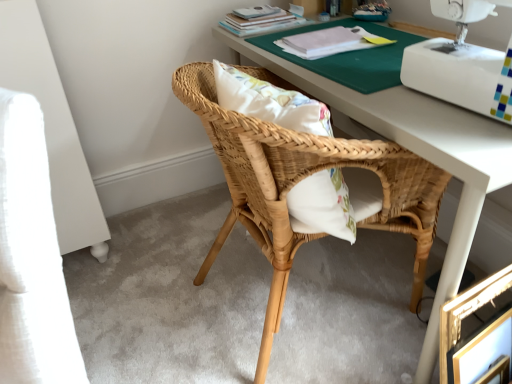
The image size is (512, 384). What do you see at coordinates (462, 63) in the screenshot?
I see `white plastic sewing machine at upper right` at bounding box center [462, 63].

Identify the location of natural wood chair at center. This screenshot has width=512, height=384. (302, 179).

In order to face matte paper book at upper center, the 2th book in the front-to-back sequence, should I rotate leftwards or rightwards?

Turn right by 1.337 degrees to look at matte paper book at upper center, the 2th book in the front-to-back sequence.

Identify the location of white plastic sewing machine at upper right. (462, 63).

From the image's perspective, is white plastic sewing machine at upper right above or below natural wood chair at center?

white plastic sewing machine at upper right is situated higher than natural wood chair at center in the image.

Are white plastic sewing machine at upper right and natural wood chair at center making contact?

white plastic sewing machine at upper right is not next to natural wood chair at center, and they're not touching.

Which of these two, white plastic sewing machine at upper right or natural wood chair at center, is wider?

natural wood chair at center is wider.

This screenshot has width=512, height=384. I want to click on picture frame that is on the right side of matte paper book at upper center, the 2th book in the front-to-back sequence, so click(x=477, y=335).

Is matte paper book at upper center, placed as the 1th book when sorted from back to front, inside the boundaries of gold metallic picture frame at lower right, or outside?

matte paper book at upper center, placed as the 1th book when sorted from back to front, cannot be found inside gold metallic picture frame at lower right.

Consider the image. Between matte paper book at upper center, placed as the 1th book when sorted from back to front, and gold metallic picture frame at lower right, which one has smaller width?

With smaller width is gold metallic picture frame at lower right.

This screenshot has height=384, width=512. I want to click on chair on the left of white plastic sewing machine at upper right, so [x=302, y=179].

Between natural wood chair at center and white plastic sewing machine at upper right, which one has larger size?

natural wood chair at center.

Considering the positions of objects natural wood chair at center and white plastic sewing machine at upper right in the image provided, who is more to the left, natural wood chair at center or white plastic sewing machine at upper right?

natural wood chair at center.

Locate an element on the screen. The image size is (512, 384). book located underneath the matte paper book at upper center, the 2th book in the front-to-back sequence (from a real-world perspective) is located at coordinates (329, 42).

Between white paper at upper center, the first book when ordered from front to back, and matte paper book at upper center, the 2th book in the front-to-back sequence, which one has smaller size?

Smaller between the two is white paper at upper center, the first book when ordered from front to back.

How distant is white paper at upper center, acting as the second book starting from the back, from matte paper book at upper center, the 2th book in the front-to-back sequence?

9.63 inches.

Is white paper at upper center, the first book when ordered from front to back, oriented away from matte paper book at upper center, the 2th book in the front-to-back sequence?

No, white paper at upper center, the first book when ordered from front to back,'s orientation is not away from matte paper book at upper center, the 2th book in the front-to-back sequence.

Considering the sizes of objects gold metallic picture frame at lower right and matte paper book at upper center, the 2th book in the front-to-back sequence, in the image provided, who is wider, gold metallic picture frame at lower right or matte paper book at upper center, the 2th book in the front-to-back sequence,?

matte paper book at upper center, the 2th book in the front-to-back sequence, is wider.

From the image's perspective, which one is positioned lower, gold metallic picture frame at lower right or matte paper book at upper center, the 2th book in the front-to-back sequence?

gold metallic picture frame at lower right appears lower in the image.

Considering the positions of points (461, 303) and (246, 15), is point (461, 303) farther from camera compared to point (246, 15)?

No, (461, 303) is closer to viewer.

Could you tell me if gold metallic picture frame at lower right is turned towards matte paper book at upper center, placed as the 1th book when sorted from back to front?

No, gold metallic picture frame at lower right is not facing towards matte paper book at upper center, placed as the 1th book when sorted from back to front.

From a real-world perspective, relative to natural wood chair at center, is white paper at upper center, acting as the second book starting from the back, vertically above or below?

white paper at upper center, acting as the second book starting from the back, is above natural wood chair at center.

Looking at this image, what's the angular difference between white paper at upper center, the first book when ordered from front to back, and natural wood chair at center's facing directions?

172 degrees separate the facing orientations of white paper at upper center, the first book when ordered from front to back, and natural wood chair at center.

Looking at this image, is white paper at upper center, the first book when ordered from front to back, to the right of natural wood chair at center from the viewer's perspective?

Correct, you'll find white paper at upper center, the first book when ordered from front to back, to the right of natural wood chair at center.

How distant is natural wood chair at center from gold metallic picture frame at lower right?

They are 41.49 centimeters apart.

Looking at the image, does natural wood chair at center seem bigger or smaller compared to gold metallic picture frame at lower right?

natural wood chair at center is bigger than gold metallic picture frame at lower right.

Looking at this image, how many degrees apart are the facing directions of natural wood chair at center and gold metallic picture frame at lower right?

72.8 degrees.

Which is closer to the camera, [223,152] or [477,333]?

The point [477,333] is closer.

Locate an element on the screen. sewing machine lying on the right of natural wood chair at center is located at coordinates (462, 63).

Locate an element on the screen. This screenshot has height=384, width=512. book that is the 2nd one above the gold metallic picture frame at lower right (from a real-world perspective) is located at coordinates (259, 20).

Looking at the image, which one is located closer to white plastic sewing machine at upper right, white paper at upper center, the first book when ordered from front to back, or gold metallic picture frame at lower right?

white paper at upper center, the first book when ordered from front to back, is closer to white plastic sewing machine at upper right.

Estimate the real-world distances between objects in this image. Which object is further from white plastic sewing machine at upper right, matte paper book at upper center, placed as the 1th book when sorted from back to front, or natural wood chair at center?

matte paper book at upper center, placed as the 1th book when sorted from back to front, lies further to white plastic sewing machine at upper right than the other object.

Estimate the real-world distances between objects in this image. Which object is further from matte paper book at upper center, placed as the 1th book when sorted from back to front, white plastic sewing machine at upper right or gold metallic picture frame at lower right?

The object further to matte paper book at upper center, placed as the 1th book when sorted from back to front, is gold metallic picture frame at lower right.

When comparing their distances from white paper at upper center, the first book when ordered from front to back, does gold metallic picture frame at lower right or matte paper book at upper center, placed as the 1th book when sorted from back to front, seem further?

Based on the image, gold metallic picture frame at lower right appears to be further to white paper at upper center, the first book when ordered from front to back.

Based on their spatial positions, is gold metallic picture frame at lower right or natural wood chair at center closer to white paper at upper center, acting as the second book starting from the back?

Among the two, natural wood chair at center is located nearer to white paper at upper center, acting as the second book starting from the back.

Looking at this image, from the image, which object appears to be farther from white plastic sewing machine at upper right, matte paper book at upper center, placed as the 1th book when sorted from back to front, or white paper at upper center, the first book when ordered from front to back?

matte paper book at upper center, placed as the 1th book when sorted from back to front, lies further to white plastic sewing machine at upper right than the other object.

Estimate the real-world distances between objects in this image. Which object is closer to natural wood chair at center, white plastic sewing machine at upper right or matte paper book at upper center, placed as the 1th book when sorted from back to front?

white plastic sewing machine at upper right.

From the image, which object appears to be nearer to gold metallic picture frame at lower right, matte paper book at upper center, the 2th book in the front-to-back sequence, or white plastic sewing machine at upper right?

white plastic sewing machine at upper right is closer to gold metallic picture frame at lower right.

I want to click on chair between white plastic sewing machine at upper right and white paper at upper center, the first book when ordered from front to back, in the front-back direction, so pyautogui.click(x=302, y=179).

Locate an element on the screen. The width and height of the screenshot is (512, 384). book between matte paper book at upper center, the 2th book in the front-to-back sequence, and gold metallic picture frame at lower right in the up-down direction is located at coordinates (329, 42).

Where is `chair between matte paper book at upper center, placed as the 1th book when sorted from back to front, and gold metallic picture frame at lower right, in the vertical direction`? This screenshot has width=512, height=384. chair between matte paper book at upper center, placed as the 1th book when sorted from back to front, and gold metallic picture frame at lower right, in the vertical direction is located at coordinates (302, 179).

Find the location of `sewing machine between matte paper book at upper center, the 2th book in the front-to-back sequence, and gold metallic picture frame at lower right in the up-down direction`. sewing machine between matte paper book at upper center, the 2th book in the front-to-back sequence, and gold metallic picture frame at lower right in the up-down direction is located at coordinates (462, 63).